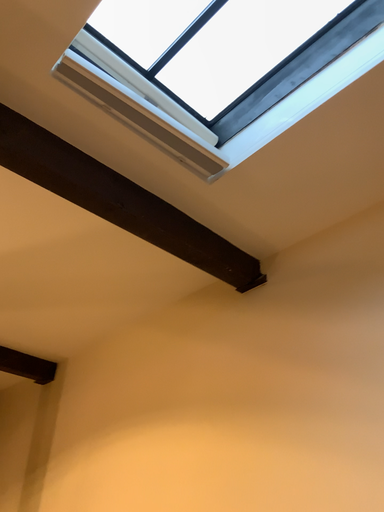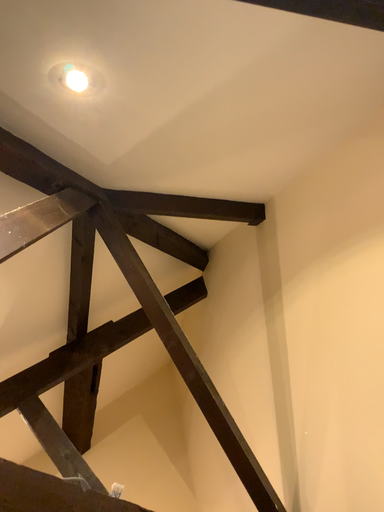
Question: Which way did the camera rotate in the video?

Choices:
 (A) rotated upward
 (B) rotated downward

Answer: (B)